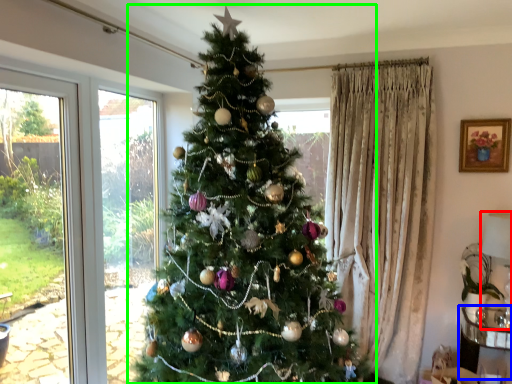
Question: Which is nearer to the lamp (highlighted by a red box)? furniture (highlighted by a blue box) or christmas tree (highlighted by a green box).

Choices:
 (A) furniture
 (B) christmas tree

Answer: (A)